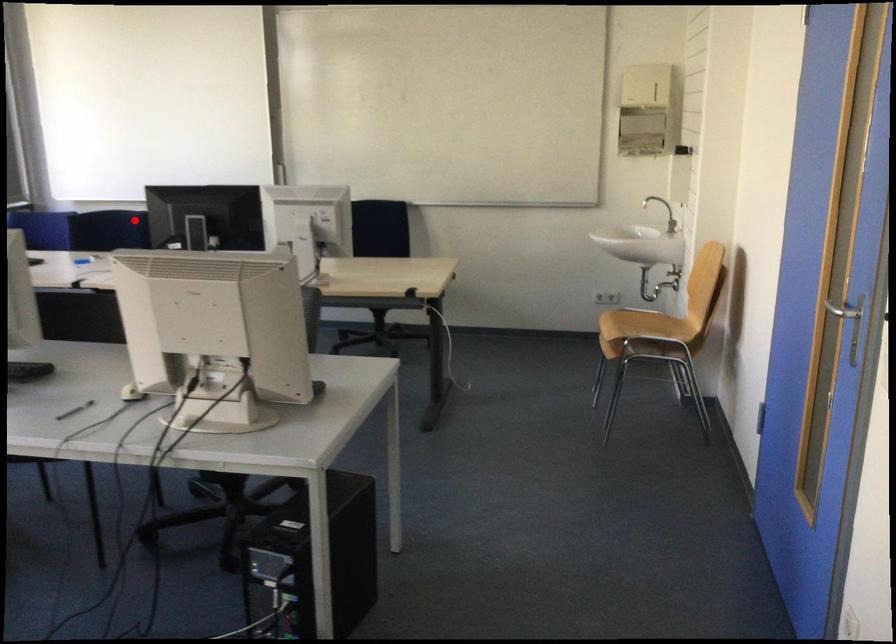
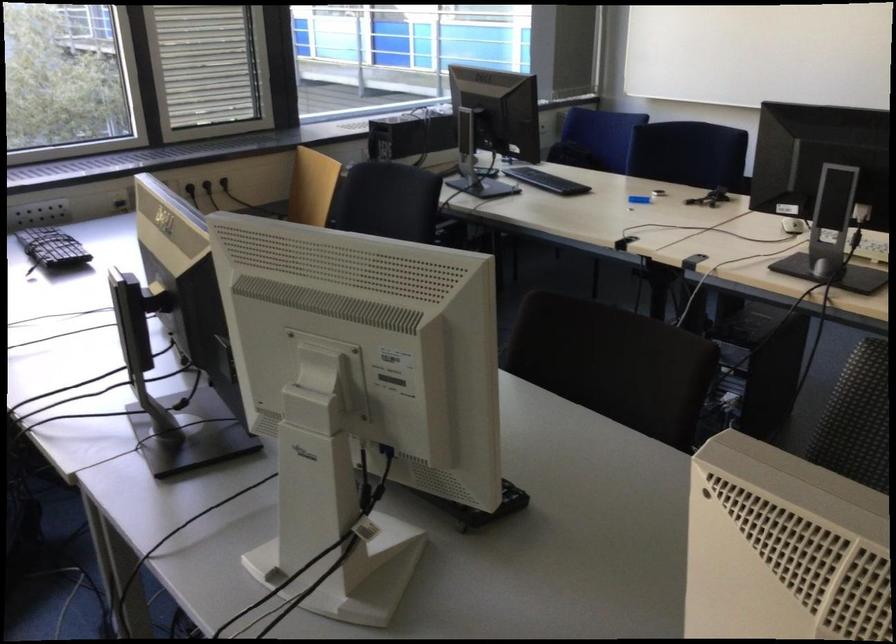
Question: I am providing you with two images of the same scene from different viewpoints. A red point is marked on the first image. Is the red point's position out of view in image 2?

Choices:
 (A) Yes
 (B) No

Answer: (B)